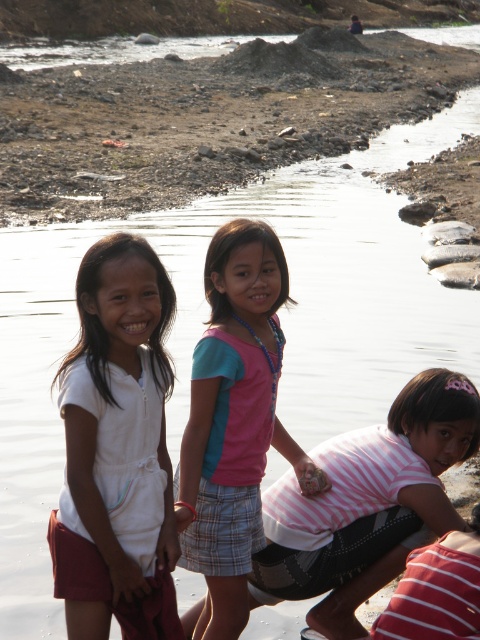
Locate an element on the screen. white cotton dress at center is located at coordinates (117, 451).

Can you confirm if white cotton dress at center is positioned to the right of pink fabric shirt at center?

In fact, white cotton dress at center is to the left of pink fabric shirt at center.

What do you see at coordinates (117, 451) in the screenshot? The image size is (480, 640). I see `white cotton dress at center` at bounding box center [117, 451].

Find the location of a particular element. white cotton dress at center is located at coordinates (117, 451).

Can you confirm if dull brown dirt at upper center is taller than pink fabric shirt at center?

Yes.

Which is in front, point (204, 109) or point (235, 292)?

Positioned in front is point (235, 292).

Does point (203, 61) come behind point (271, 228)?

Yes, point (203, 61) is farther from viewer.

Where is `dull brown dirt at upper center`? Image resolution: width=480 pixels, height=640 pixels. dull brown dirt at upper center is located at coordinates (207, 118).

Is white cotton dress at center positioned at the back of striped cotton shirt at center?

No, white cotton dress at center is in front of striped cotton shirt at center.

Measure the distance between white cotton dress at center and camera.

white cotton dress at center and camera are 6.14 meters apart.

Describe the element at coordinates (117, 451) in the screenshot. I see `white cotton dress at center` at that location.

Locate an element on the screen. white cotton dress at center is located at coordinates (117, 451).